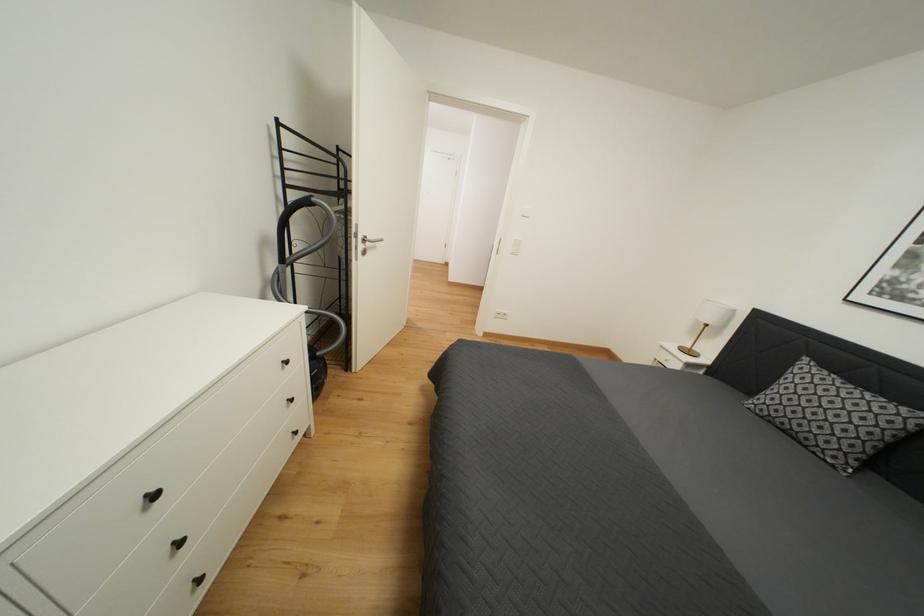
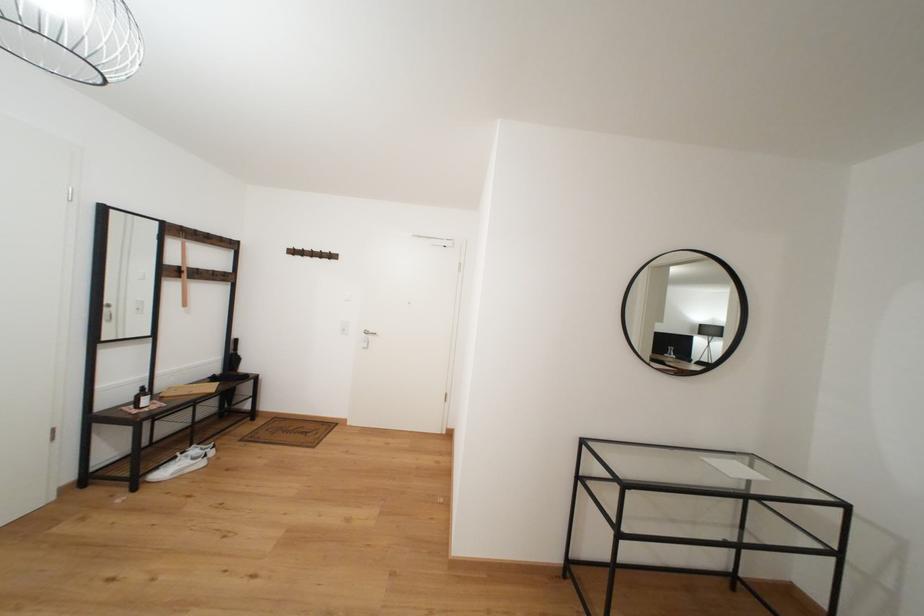
Question: In a continuous first-person perspective shot, in which direction is the camera moving?

Choices:
 (A) Left
 (B) Right
 (C) Forward
 (D) Backward

Answer: (C)